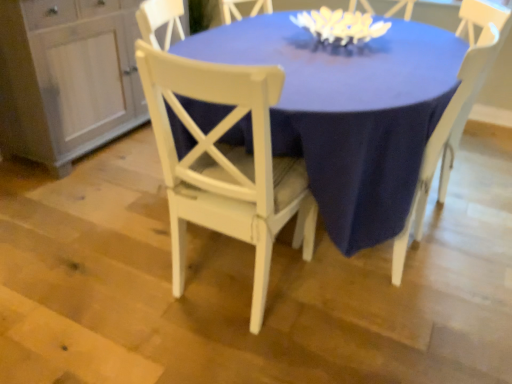
Question: Can you confirm if white wood chair at center, positioned as the 1th chair in left-to-right order, is wider than matte white table at center?

Choices:
 (A) no
 (B) yes

Answer: (A)

Question: Considering the relative sizes of white wood chair at center, the second chair when ordered from right to left, and matte white table at center in the image provided, is white wood chair at center, the second chair when ordered from right to left, taller than matte white table at center?

Choices:
 (A) no
 (B) yes

Answer: (B)

Question: From a real-world perspective, is white wood chair at center, the second chair when ordered from right to left, positioned under matte white table at center based on gravity?

Choices:
 (A) yes
 (B) no

Answer: (B)

Question: Can you confirm if white wood chair at center, positioned as the 1th chair in left-to-right order, is positioned to the right of matte white table at center?

Choices:
 (A) yes
 (B) no

Answer: (B)

Question: Is white wood chair at center, positioned as the 1th chair in left-to-right order, with matte white table at center?

Choices:
 (A) no
 (B) yes

Answer: (A)

Question: From a real-world perspective, is white wood chair at center, positioned as the 1th chair in left-to-right order, positioned above or below white wood dresser at left?

Choices:
 (A) above
 (B) below

Answer: (A)

Question: Considering their positions, is white wood chair at center, positioned as the 1th chair in left-to-right order, located in front of or behind white wood dresser at left?

Choices:
 (A) front
 (B) behind

Answer: (A)

Question: Do you think white wood chair at center, positioned as the 1th chair in left-to-right order, is within white wood dresser at left, or outside of it?

Choices:
 (A) outside
 (B) inside

Answer: (A)

Question: Is white wood chair at center, positioned as the 1th chair in left-to-right order, bigger or smaller than white wood dresser at left?

Choices:
 (A) big
 (B) small

Answer: (B)

Question: Is matte white table at center in front of or behind white wood chair at center, positioned as the 1th chair in left-to-right order, in the image?

Choices:
 (A) front
 (B) behind

Answer: (B)

Question: In terms of height, does matte white table at center look taller or shorter compared to white wood chair at center, positioned as the 1th chair in left-to-right order?

Choices:
 (A) tall
 (B) short

Answer: (B)

Question: Is matte white table at center situated inside white wood chair at center, positioned as the 1th chair in left-to-right order, or outside?

Choices:
 (A) outside
 (B) inside

Answer: (A)

Question: Is matte white table at center bigger or smaller than white wood chair at center, positioned as the 1th chair in left-to-right order?

Choices:
 (A) big
 (B) small

Answer: (A)

Question: Considering the positions of point pos(2,72) and point pos(418,89), is point pos(2,72) closer or farther from the camera than point pos(418,89)?

Choices:
 (A) closer
 (B) farther

Answer: (B)

Question: From a real-world perspective, is white wood dresser at left above or below matte white table at center?

Choices:
 (A) above
 (B) below

Answer: (A)